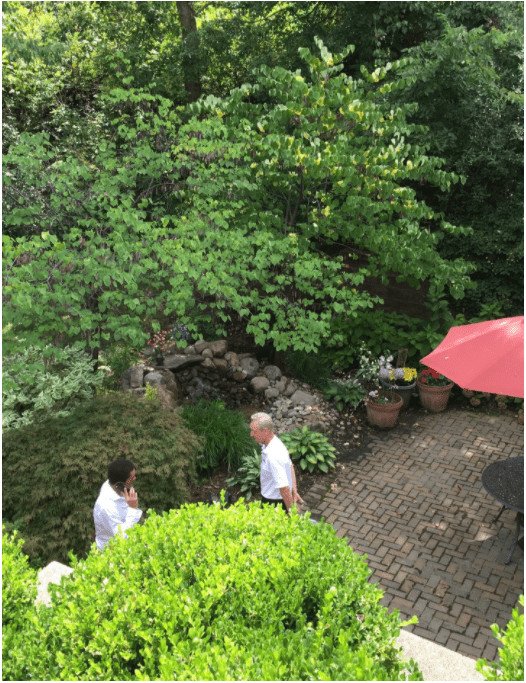
Locate an element on the screen. Image resolution: width=526 pixels, height=683 pixels. flower pot is located at coordinates (374, 413), (410, 395), (433, 393).